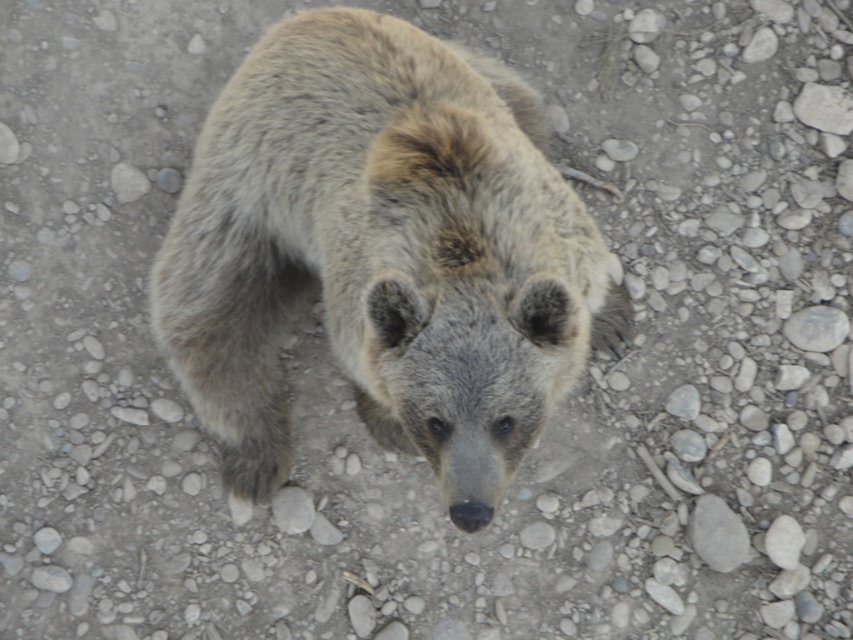
Based on the scene description, where is the fuzzy fur bear at center located in terms of its 2D coordinates?

The fuzzy fur bear at center is located at the 2D coordinates of point (381, 253).

You are a photographer trying to capture the bear in the image. You notice the fuzzy fur bear at center and the gray smooth rock at lower right. Which object is positioned higher in the image?

The fuzzy fur bear at center is located above the gray smooth rock at lower right, so it is positioned higher in the image.